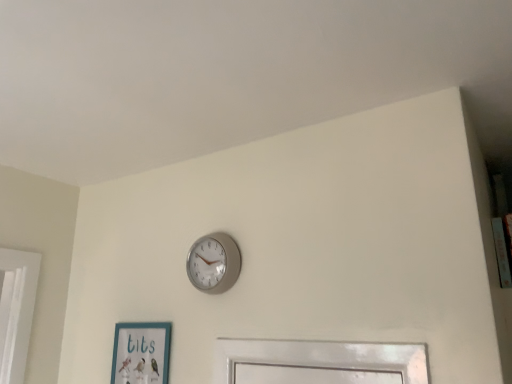
Question: Is silver metallic clock at upper center located within teal matte picture frame at lower left?

Choices:
 (A) no
 (B) yes

Answer: (A)

Question: From the image's perspective, is teal matte picture frame at lower left beneath silver metallic clock at upper center?

Choices:
 (A) yes
 (B) no

Answer: (A)

Question: Is teal matte picture frame at lower left oriented away from silver metallic clock at upper center?

Choices:
 (A) yes
 (B) no

Answer: (B)

Question: Can you confirm if teal matte picture frame at lower left is positioned to the left of silver metallic clock at upper center?

Choices:
 (A) yes
 (B) no

Answer: (A)

Question: From a real-world perspective, is teal matte picture frame at lower left beneath silver metallic clock at upper center?

Choices:
 (A) yes
 (B) no

Answer: (A)

Question: Is teal matte picture frame at lower left not near silver metallic clock at upper center?

Choices:
 (A) no
 (B) yes

Answer: (A)

Question: Is silver metallic clock at upper center smaller than teal matte picture frame at lower left?

Choices:
 (A) no
 (B) yes

Answer: (B)

Question: From a real-world perspective, is silver metallic clock at upper center physically above teal matte picture frame at lower left?

Choices:
 (A) yes
 (B) no

Answer: (A)

Question: Is silver metallic clock at upper center completely or partially outside of teal matte picture frame at lower left?

Choices:
 (A) no
 (B) yes

Answer: (B)

Question: Does silver metallic clock at upper center appear on the right side of teal matte picture frame at lower left?

Choices:
 (A) no
 (B) yes

Answer: (B)

Question: Is the position of silver metallic clock at upper center less distant than that of teal matte picture frame at lower left?

Choices:
 (A) yes
 (B) no

Answer: (A)

Question: Considering the relative sizes of silver metallic clock at upper center and teal matte picture frame at lower left in the image provided, is silver metallic clock at upper center wider than teal matte picture frame at lower left?

Choices:
 (A) yes
 (B) no

Answer: (A)

Question: Is silver metallic clock at upper center in front of or behind teal matte picture frame at lower left in the image?

Choices:
 (A) behind
 (B) front

Answer: (B)